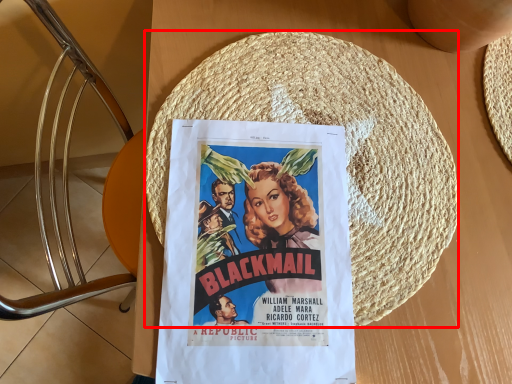
Question: Observing the image, what is the correct spatial positioning of straw hat (annotated by the red box) in reference to poster?

Choices:
 (A) left
 (B) right

Answer: (B)